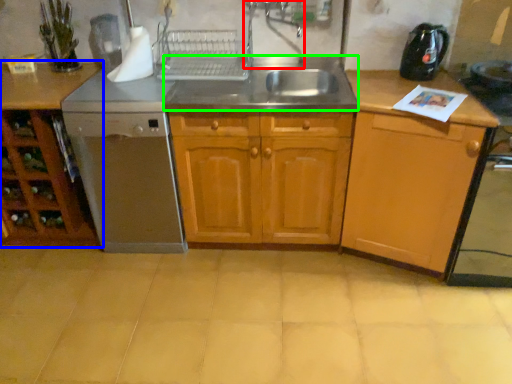
Question: Considering the real-world distances, which object is farthest from faucet (highlighted by a red box)? cabinetry (highlighted by a blue box) or sink (highlighted by a green box)?

Choices:
 (A) cabinetry
 (B) sink

Answer: (A)